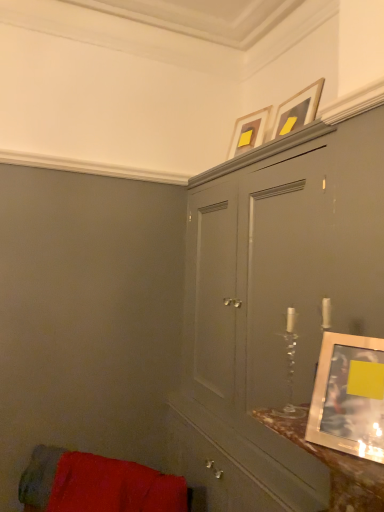
Question: Is matte gold picture frame at upper center, marked as the third picture frame in a front-to-back arrangement, completely or partially outside of matte gray cabinet at upper center?

Choices:
 (A) yes
 (B) no

Answer: (A)

Question: From a real-world perspective, is matte gold picture frame at upper center, the first picture frame in the top-to-bottom sequence, on matte gray cabinet at upper center?

Choices:
 (A) no
 (B) yes

Answer: (B)

Question: From the image's perspective, would you say matte gold picture frame at upper center, the first picture frame viewed from the back, is shown under matte gray cabinet at upper center?

Choices:
 (A) yes
 (B) no

Answer: (B)

Question: From a real-world perspective, is matte gold picture frame at upper center, the first picture frame viewed from the back, positioned under matte gray cabinet at upper center based on gravity?

Choices:
 (A) yes
 (B) no

Answer: (B)

Question: Is matte gold picture frame at upper center, the first picture frame in the top-to-bottom sequence, aimed at matte gray cabinet at upper center?

Choices:
 (A) yes
 (B) no

Answer: (B)

Question: Considering their positions, is velvet red cushion at lower left located in front of or behind metallic silver picture frame at right, the first picture frame from the front?

Choices:
 (A) behind
 (B) front

Answer: (A)

Question: Looking at their shapes, would you say velvet red cushion at lower left is wider or thinner than metallic silver picture frame at right, the third picture frame positioned from the top?

Choices:
 (A) wide
 (B) thin

Answer: (A)

Question: Choose the correct answer: Is velvet red cushion at lower left inside metallic silver picture frame at right, the third picture frame positioned from the top, or outside it?

Choices:
 (A) outside
 (B) inside

Answer: (A)

Question: From their relative heights in the image, would you say velvet red cushion at lower left is taller or shorter than metallic silver picture frame at right, the third picture frame positioned from the top?

Choices:
 (A) tall
 (B) short

Answer: (A)

Question: Considering the positions of matte gold picture frame at upper center, which ranks as the third picture frame in bottom-to-top order, and velvet red cushion at lower left in the image, is matte gold picture frame at upper center, which ranks as the third picture frame in bottom-to-top order, taller or shorter than velvet red cushion at lower left?

Choices:
 (A) short
 (B) tall

Answer: (A)

Question: In terms of size, does matte gold picture frame at upper center, the first picture frame in the top-to-bottom sequence, appear bigger or smaller than velvet red cushion at lower left?

Choices:
 (A) small
 (B) big

Answer: (A)

Question: In the image, is matte gold picture frame at upper center, which ranks as the third picture frame in bottom-to-top order, on the left side or the right side of velvet red cushion at lower left?

Choices:
 (A) left
 (B) right

Answer: (B)

Question: From the image's perspective, is matte gold picture frame at upper center, marked as the third picture frame in a front-to-back arrangement, above or below velvet red cushion at lower left?

Choices:
 (A) above
 (B) below

Answer: (A)

Question: From their relative heights in the image, would you say metallic silver picture frame at right, the first picture frame from the front, is taller or shorter than matte gray cabinet at upper center?

Choices:
 (A) tall
 (B) short

Answer: (B)

Question: From a real-world perspective, is metallic silver picture frame at right, which is the first picture frame from bottom to top, positioned above or below matte gray cabinet at upper center?

Choices:
 (A) below
 (B) above

Answer: (B)